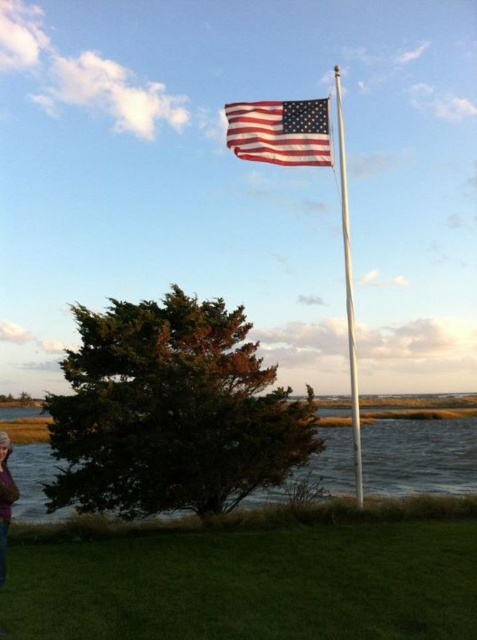
Can you confirm if green grass at lower center is taller than purple sweater at lower left?

Correct, green grass at lower center is much taller as purple sweater at lower left.

Does point (335, 460) come in front of point (1, 550)?

No, it is not.

Locate an element on the screen. green grass at lower center is located at coordinates (420, 456).

Which is more to the right, silver metallic flag pole at upper center or purple sweater at lower left?

From the viewer's perspective, silver metallic flag pole at upper center appears more on the right side.

Does silver metallic flag pole at upper center come in front of purple sweater at lower left?

That is False.

Where is `silver metallic flag pole at upper center`? The image size is (477, 640). silver metallic flag pole at upper center is located at coordinates (349, 296).

Which is behind, point (19, 452) or point (247, 138)?

Point (19, 452)

Does green grass at lower center have a lesser height compared to american flag at upper center?

Correct, green grass at lower center is not as tall as american flag at upper center.

Between point (437, 486) and point (309, 147), which one is positioned in front?

Point (309, 147) is in front.

This screenshot has height=640, width=477. I want to click on green grass at lower center, so click(x=420, y=456).